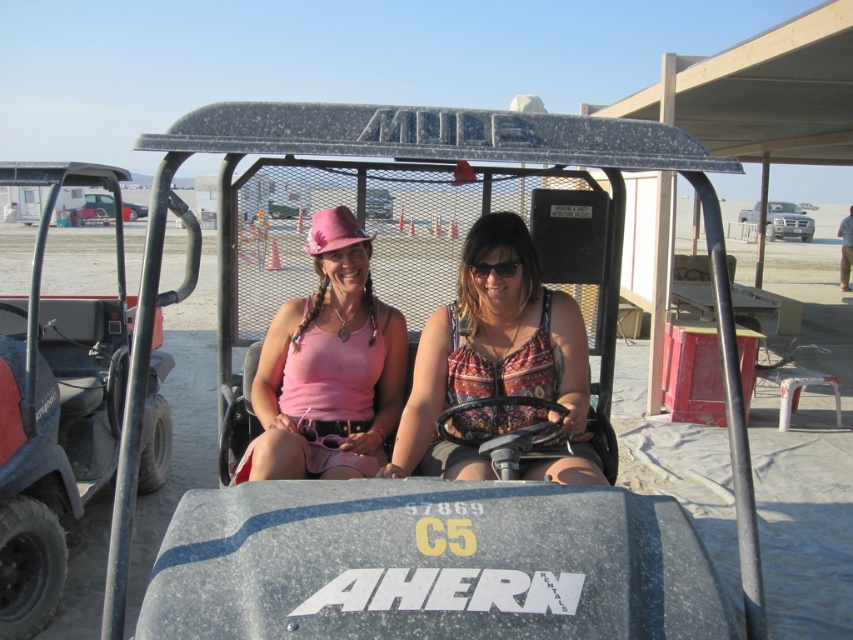
Question: Is matte black golf cart at center wider than printed fabric tank top at center?

Choices:
 (A) no
 (B) yes

Answer: (B)

Question: Is printed fabric tank top at center wider than pink fabric tank top at center?

Choices:
 (A) no
 (B) yes

Answer: (B)

Question: Which point is farther to the camera?

Choices:
 (A) printed fabric tank top at center
 (B) pink fabric tank top at center
 (C) black plastic goggles at center
 (D) matte black golf cart at center

Answer: (C)

Question: Among these objects, which one is farthest from the camera?

Choices:
 (A) pink fabric tank top at center
 (B) black plastic goggles at center
 (C) printed fabric tank top at center
 (D) matte black golf cart at center

Answer: (B)

Question: Observing the image, what is the correct spatial positioning of matte black golf cart at center in reference to pink fabric tank top at center?

Choices:
 (A) right
 (B) left

Answer: (A)

Question: Which object appears closest to the camera in this image?

Choices:
 (A) printed fabric tank top at center
 (B) black plastic goggles at center
 (C) matte black golf cart at center
 (D) pink fabric tank top at center

Answer: (C)